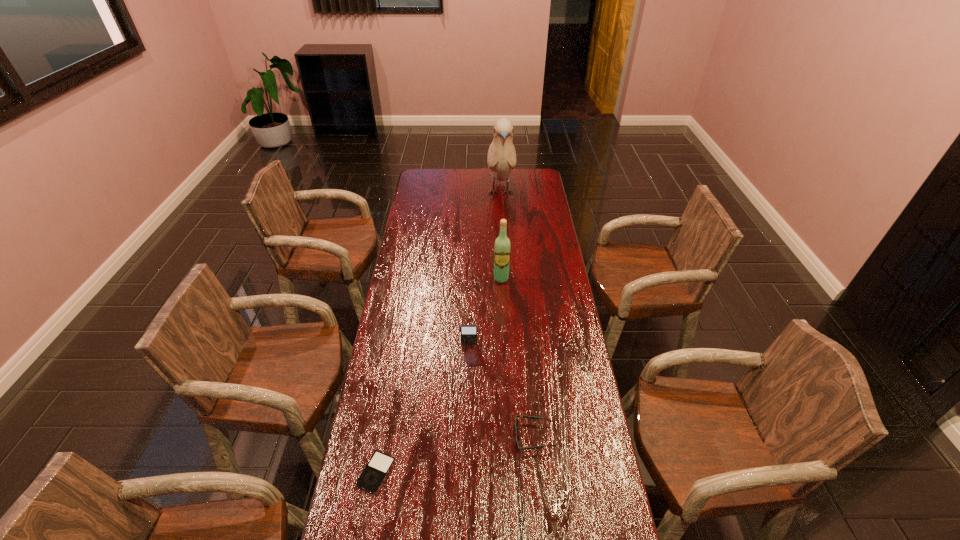
Identify the location of blank space at the left edge of the desktop. (396, 290).

You are a GUI agent. You are given a task and a screenshot of the screen. Output one action in this format:
    pyautogui.click(x=<x>, y=<y>)
    Task: Click on the vacant space at the right edge of the desktop
    
    Given the screenshot: What is the action you would take?
    pyautogui.click(x=534, y=219)

This screenshot has height=540, width=960. Find the location of `free space at the far left corner`. free space at the far left corner is located at coordinates (424, 187).

The height and width of the screenshot is (540, 960). Find the location of `vacant point at the far right corner`. vacant point at the far right corner is located at coordinates (534, 170).

At what (x,y) coordinates should I click in order to perform the action: click on blank region between the left iPod and the right iPod. Please return your answer as a coordinate pair (x, y). The image size is (960, 540). Looking at the image, I should click on (422, 408).

Locate an element on the screen. The height and width of the screenshot is (540, 960). blank region between the tallest object and the nearer iPod is located at coordinates (439, 333).

Identify the location of vacant space that's between the shorter iPod and the second tallest object. The image size is (960, 540). (x=439, y=376).

Locate an element on the screen. vacant space in between the wine bottle and the third shortest object is located at coordinates (485, 312).

I want to click on blank region between the wine bottle and the sunglasses, so click(517, 357).

At what (x,y) coordinates should I click in order to perform the action: click on empty space between the fourth nearest object and the taller iPod. Please return your answer as a coordinate pair (x, y). Looking at the image, I should click on (485, 312).